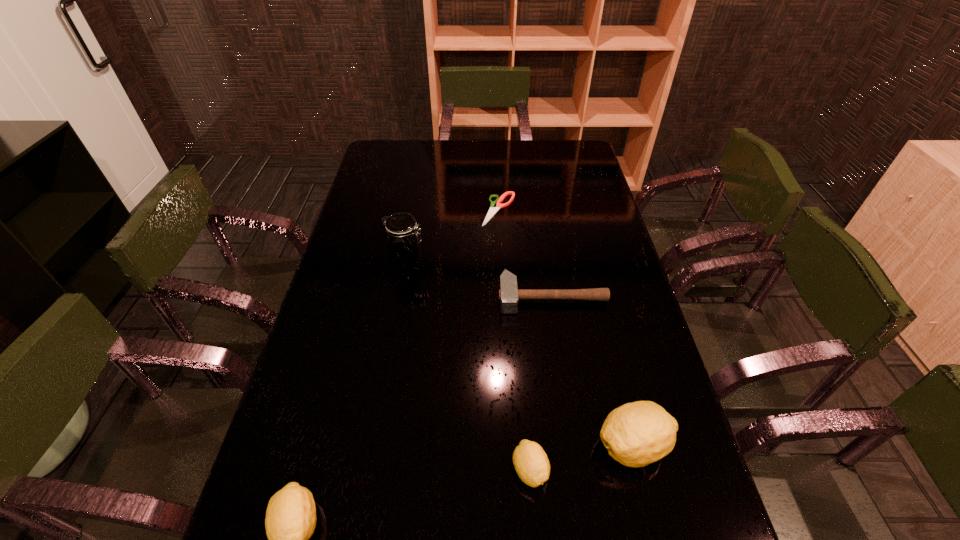
What are the coordinates of `blank space at the near edge of the desktop` in the screenshot? It's located at (457, 529).

The height and width of the screenshot is (540, 960). What are the coordinates of `free location at the left edge` in the screenshot? It's located at tap(307, 372).

What are the coordinates of `free space at the right edge of the desktop` in the screenshot? It's located at (575, 216).

Where is `vacant region at the near left corner of the desktop`? vacant region at the near left corner of the desktop is located at coordinates (336, 489).

The width and height of the screenshot is (960, 540). In the image, there is a desktop. Find the location of `vacant space at the near right corner`. vacant space at the near right corner is located at coordinates (638, 487).

Identify the location of free space between the scissors and the fourth nearest object. (525, 253).

I want to click on empty location between the second lemon from right to left and the shortest object, so click(515, 339).

At what (x,y) coordinates should I click in order to perform the action: click on unoccupied position between the jar and the scissors. Please return your answer as a coordinate pair (x, y). Image resolution: width=960 pixels, height=540 pixels. Looking at the image, I should click on 453,236.

Identify the location of free space that is in between the second shortest object and the second lemon from right to left. (541, 383).

The height and width of the screenshot is (540, 960). I want to click on unoccupied position between the fourth nearest object and the shortest object, so click(x=525, y=253).